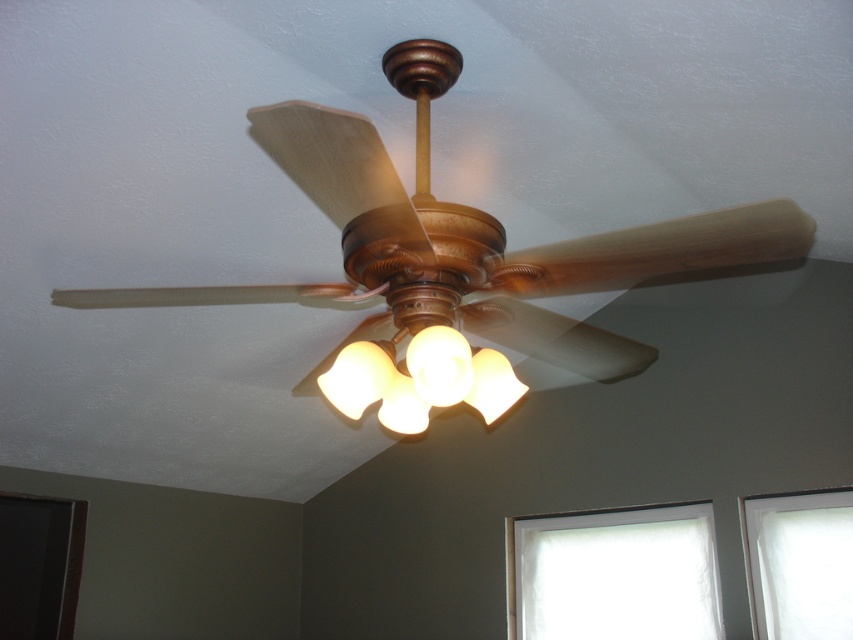
Can you confirm if wooden ceiling fan at center is positioned above translucent frosted glass light fixture at center?

Indeed, wooden ceiling fan at center is positioned over translucent frosted glass light fixture at center.

Can you confirm if wooden ceiling fan at center is positioned to the left of translucent frosted glass light fixture at center?

Yes, wooden ceiling fan at center is to the left of translucent frosted glass light fixture at center.

Does point (395, 83) lie behind point (335, 396)?

Yes, it is behind point (335, 396).

Locate an element on the screen. wooden ceiling fan at center is located at coordinates coord(456,257).